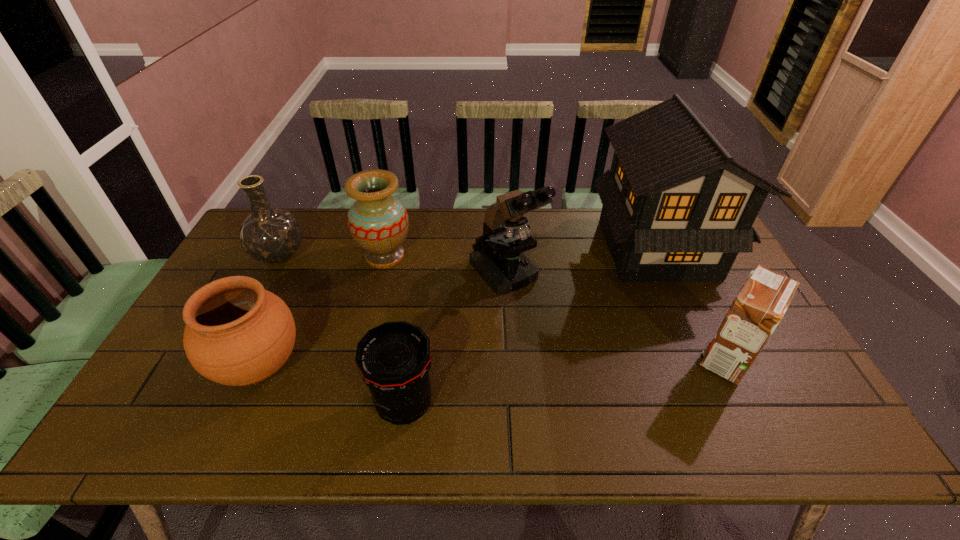
You are a GUI agent. You are given a task and a screenshot of the screen. Output one action in this format:
    pyautogui.click(x=<x>, y=<y>)
    Task: Click on the microscope situated at the far edge
    The image size is (960, 540).
    Given the screenshot: What is the action you would take?
    pos(501,263)

You are a GUI agent. You are given a task and a screenshot of the screen. Output one action in this format:
    pyautogui.click(x=<x>, y=<y>)
    Task: Click on the object that is at the near edge
    The height and width of the screenshot is (540, 960).
    Given the screenshot: What is the action you would take?
    coord(394,359)

The image size is (960, 540). I want to click on vase positioned at the left edge, so click(270, 235).

Identify the location of pottery that is positioned at the left edge. (237, 333).

The width and height of the screenshot is (960, 540). I want to click on dollhouse located in the right edge section of the desktop, so click(x=682, y=194).

Identify the location of carton present at the right edge. Image resolution: width=960 pixels, height=540 pixels. (761, 303).

At what (x,y) coordinates should I click in order to perform the action: click on object that is positioned at the far left corner. Please return your answer as a coordinate pair (x, y). Looking at the image, I should click on (270, 235).

At what (x,y) coordinates should I click in order to perform the action: click on object that is at the far right corner. Please return your answer as a coordinate pair (x, y). Looking at the image, I should click on (682, 194).

Identify the location of vacant area at the far edge. The image size is (960, 540). (549, 215).

Identify the location of vacant space at the near left corner of the desktop. (186, 442).